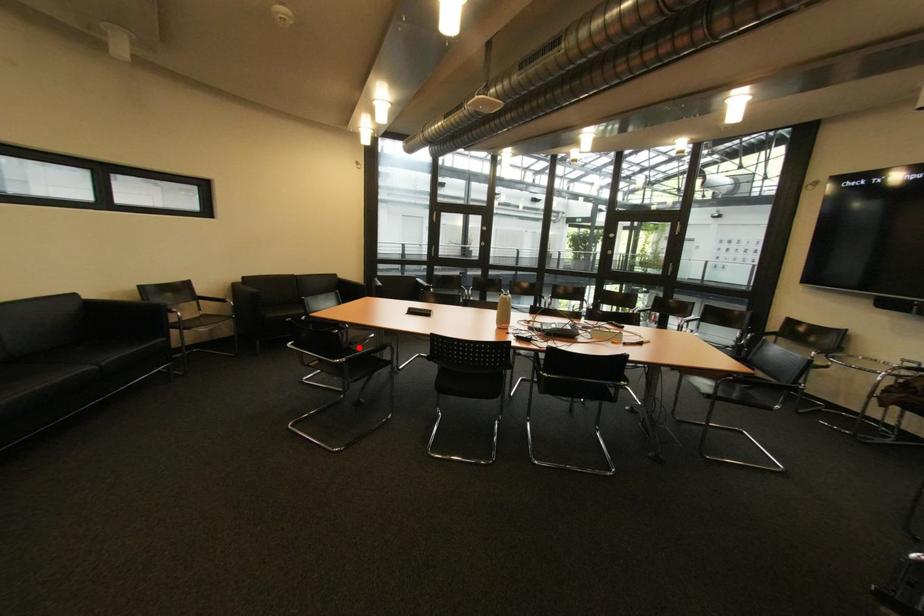
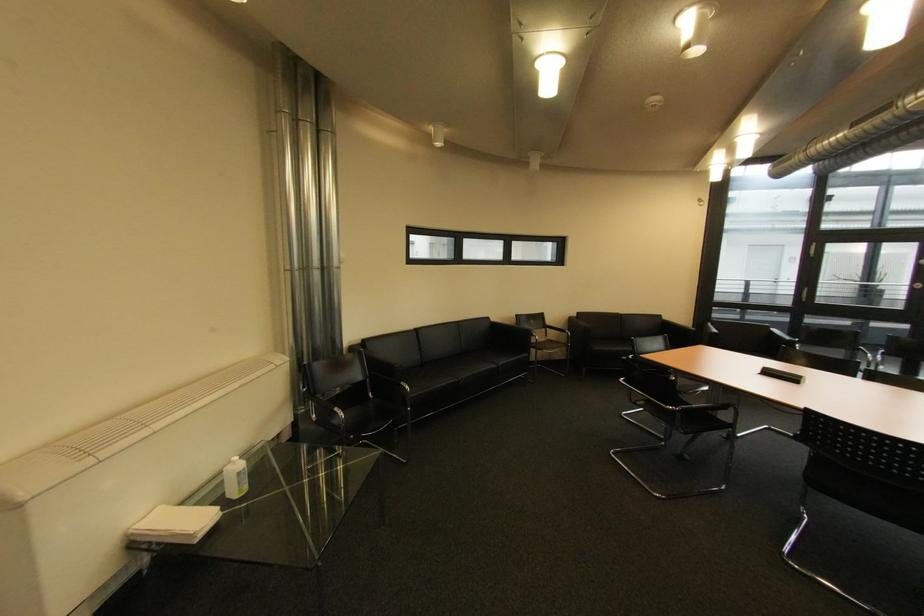
Question: I am providing you with two images of the same scene from different viewpoints. A red point is marked on the first image. Can you still see the location of the red point in image 2?

Choices:
 (A) Yes
 (B) No

Answer: (A)